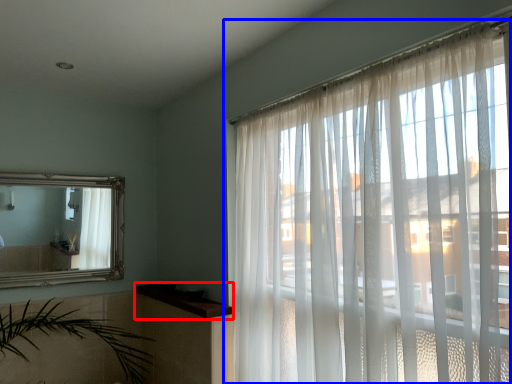
Question: Which point is closer to the camera, window sill (highlighted by a red box) or window (highlighted by a blue box)?

Choices:
 (A) window sill
 (B) window

Answer: (B)